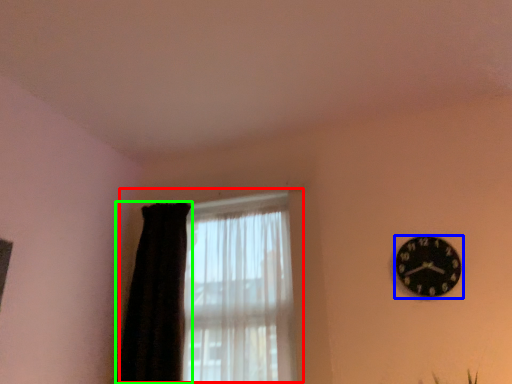
Question: Based on their relative distances, which object is nearer to window (highlighted by a red box)? Choose from wall clock (highlighted by a blue box) and curtain (highlighted by a green box).

Choices:
 (A) wall clock
 (B) curtain

Answer: (B)